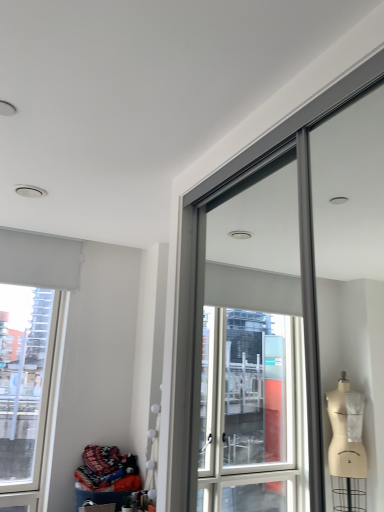
Question: From the image's perspective, is knitted fabric at lower left over white matte window at upper left?

Choices:
 (A) no
 (B) yes

Answer: (A)

Question: Can you confirm if knitted fabric at lower left is thinner than white matte window at upper left?

Choices:
 (A) yes
 (B) no

Answer: (B)

Question: Is knitted fabric at lower left surrounding white matte window at upper left?

Choices:
 (A) no
 (B) yes

Answer: (A)

Question: Considering the relative sizes of knitted fabric at lower left and white matte window at upper left in the image provided, is knitted fabric at lower left bigger than white matte window at upper left?

Choices:
 (A) yes
 (B) no

Answer: (B)

Question: Is knitted fabric at lower left in front of white matte window at upper left?

Choices:
 (A) yes
 (B) no

Answer: (A)

Question: Is knitted fabric at lower left to the left of white matte window at upper left from the viewer's perspective?

Choices:
 (A) yes
 (B) no

Answer: (B)

Question: Can you see white matte window at upper left touching knitted fabric at lower left?

Choices:
 (A) no
 (B) yes

Answer: (A)

Question: Can knitted fabric at lower left be found inside white matte window at upper left?

Choices:
 (A) no
 (B) yes

Answer: (A)

Question: Can you confirm if white matte window at upper left is positioned to the right of knitted fabric at lower left?

Choices:
 (A) yes
 (B) no

Answer: (B)

Question: Is white matte window at upper left located outside knitted fabric at lower left?

Choices:
 (A) yes
 (B) no

Answer: (A)

Question: Is white matte window at upper left facing away from knitted fabric at lower left?

Choices:
 (A) yes
 (B) no

Answer: (B)

Question: From a real-world perspective, is white matte window at upper left below knitted fabric at lower left?

Choices:
 (A) yes
 (B) no

Answer: (B)

Question: From the image's perspective, is knitted fabric at lower left positioned above or below white matte window at upper left?

Choices:
 (A) above
 (B) below

Answer: (B)